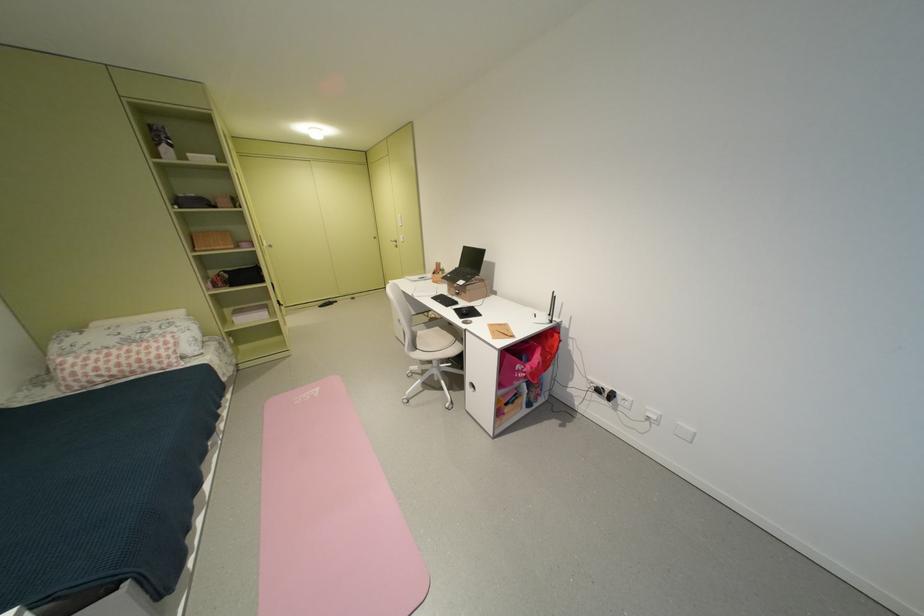
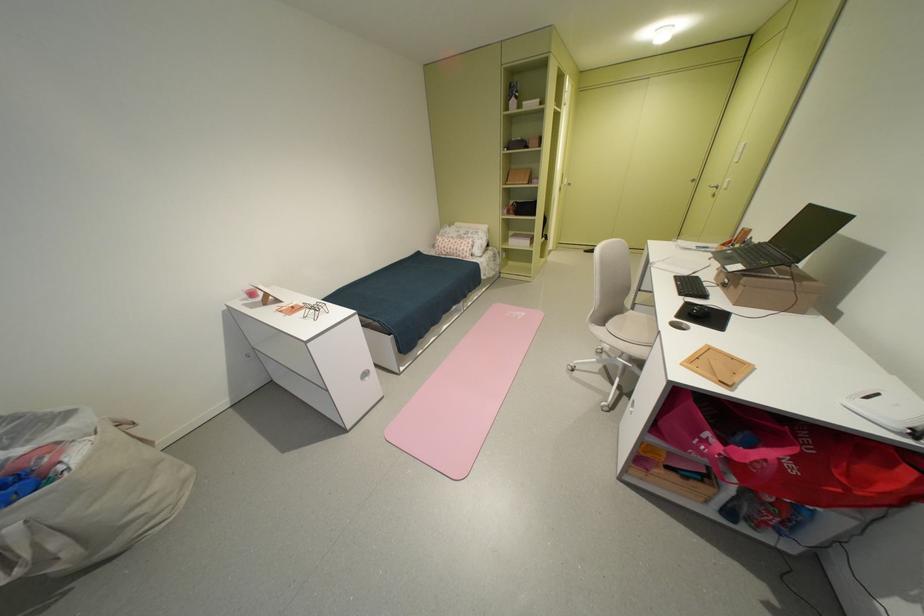
Based on the photo, the images are taken continuously from a first-person perspective. In which direction is your viewpoint rotating?

The camera rotated toward left-down.